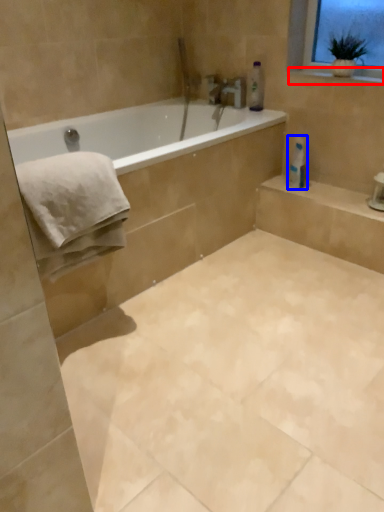
Question: Which object is further to the camera taking this photo, window sill (highlighted by a red box) or toilet paper (highlighted by a blue box)?

Choices:
 (A) window sill
 (B) toilet paper

Answer: (B)